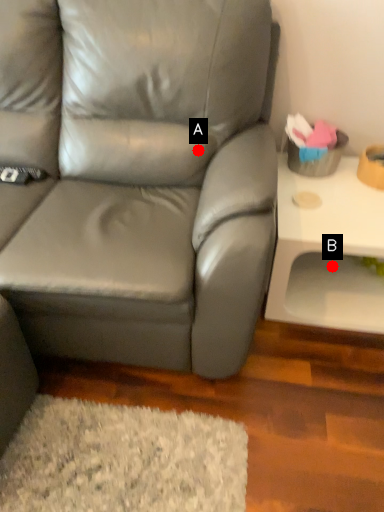
Question: Two points are circled on the image, labeled by A and B beside each circle. Which of the following is the farthest from the observer?

Choices:
 (A) A is further
 (B) B is further

Answer: (B)